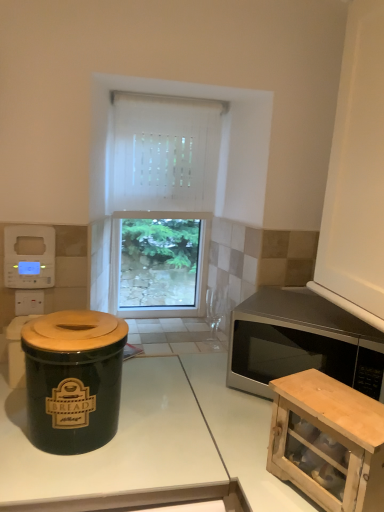
Question: From the image's perspective, does white glossy countertop at center appear higher than white plastic digital clock at upper left?

Choices:
 (A) yes
 (B) no

Answer: (B)

Question: Does white glossy countertop at center turn towards white plastic digital clock at upper left?

Choices:
 (A) yes
 (B) no

Answer: (B)

Question: From a real-world perspective, is white glossy countertop at center physically above white plastic digital clock at upper left?

Choices:
 (A) no
 (B) yes

Answer: (A)

Question: Can you confirm if white glossy countertop at center is taller than white plastic digital clock at upper left?

Choices:
 (A) no
 (B) yes

Answer: (B)

Question: Does white glossy countertop at center have a lesser width compared to white plastic digital clock at upper left?

Choices:
 (A) yes
 (B) no

Answer: (B)

Question: Does white glossy countertop at center have a lesser height compared to white plastic digital clock at upper left?

Choices:
 (A) no
 (B) yes

Answer: (A)

Question: From a real-world perspective, is wooden cabinet at lower right over white fabric curtain at center?

Choices:
 (A) yes
 (B) no

Answer: (B)

Question: From the image's perspective, is wooden cabinet at lower right located above white fabric curtain at center?

Choices:
 (A) no
 (B) yes

Answer: (A)

Question: Is wooden cabinet at lower right looking in the opposite direction of white fabric curtain at center?

Choices:
 (A) yes
 (B) no

Answer: (B)

Question: Does wooden cabinet at lower right lie in front of white fabric curtain at center?

Choices:
 (A) yes
 (B) no

Answer: (A)

Question: Is wooden cabinet at lower right thinner than white fabric curtain at center?

Choices:
 (A) no
 (B) yes

Answer: (A)

Question: Is wooden cabinet at lower right shorter than white fabric curtain at center?

Choices:
 (A) yes
 (B) no

Answer: (A)

Question: From the image's perspective, is white plastic digital clock at upper left below satin silver microwave at right?

Choices:
 (A) no
 (B) yes

Answer: (A)